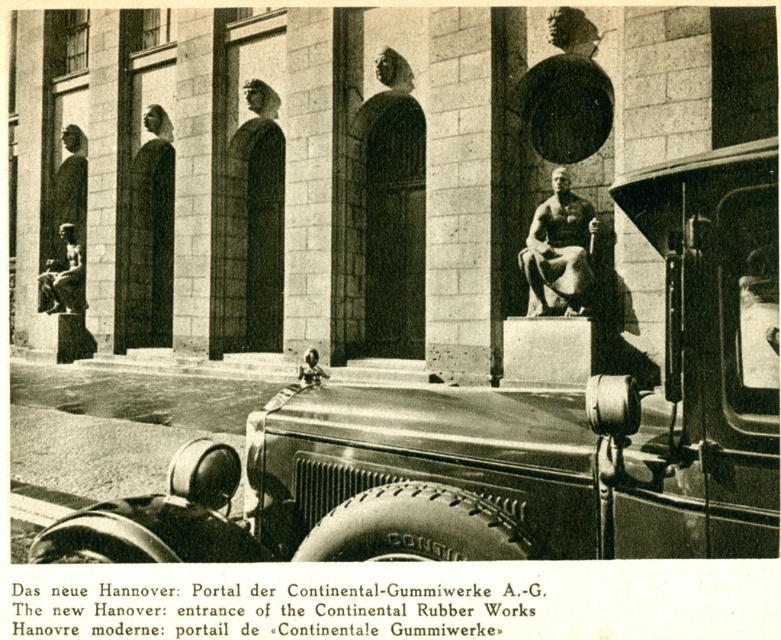
Question: Is shiny chrome car at center to the right of polished bronze statue at center from the viewer's perspective?

Choices:
 (A) yes
 (B) no

Answer: (B)

Question: Considering the real-world distances, which object is farthest from the polished bronze statue at center?

Choices:
 (A) matte bronze statue at center
 (B) shiny chrome car at center

Answer: (A)

Question: Which of the following is the farthest from the observer?

Choices:
 (A) matte bronze statue at center
 (B) polished bronze statue at center

Answer: (A)

Question: Is polished bronze statue at center thinner than matte bronze statue at center?

Choices:
 (A) no
 (B) yes

Answer: (B)

Question: Is shiny chrome car at center positioned in front of matte bronze statue at center?

Choices:
 (A) no
 (B) yes

Answer: (B)

Question: Among these objects, which one is nearest to the camera?

Choices:
 (A) matte bronze statue at center
 (B) shiny chrome car at center

Answer: (B)